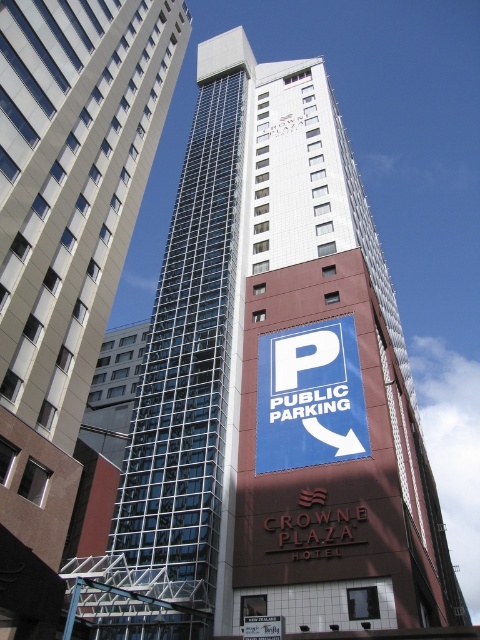
Is glassy steel skyscraper at center to the left of blue paper sign at center from the viewer's perspective?

Yes, glassy steel skyscraper at center is to the left of blue paper sign at center.

Which is more to the left, glassy steel skyscraper at center or blue paper sign at center?

glassy steel skyscraper at center is more to the left.

Find the location of `glassy steel skyscraper at center`. glassy steel skyscraper at center is located at coordinates (72, 182).